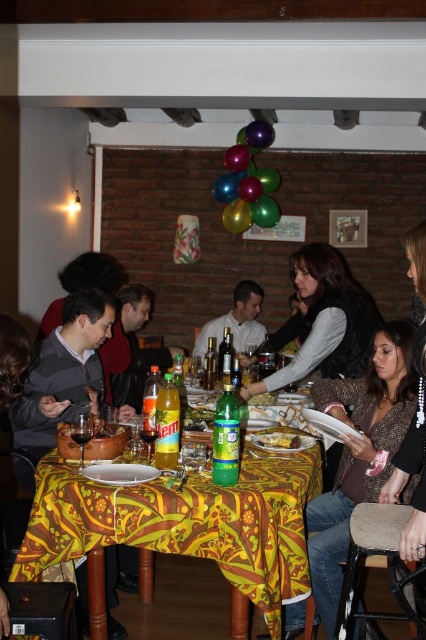
You are a guest at the dinner party and want to grab a drink. The orange matte soda at table center and the yellow matte plate at center are both in your way. Which one do you need to move first to reach the drink?

The orange matte soda at table center is bigger than the yellow matte plate at center, so you should move the orange matte soda at table center first to reach the drink.

You are a guest at this dinner party and want to grab a drink from the table. The green glass bottle at center and the matte white shirt at center are both in your way. Which object is taller, making it more likely to block your view of the drinks?

The green glass bottle at center is taller than the matte white shirt at center, so it would more likely block your view of the drinks.